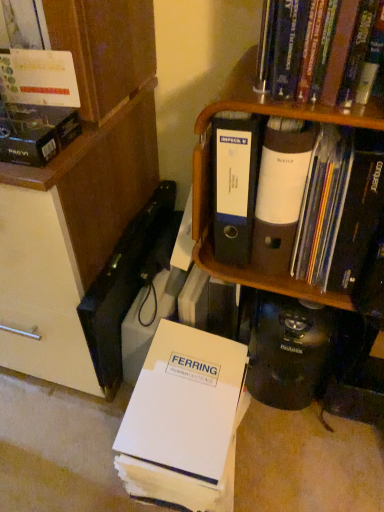
Question: Is matte black folder at upper right, the third book positioned from the top, wider or thinner than brown cardboard shelf at upper right?

Choices:
 (A) thin
 (B) wide

Answer: (A)

Question: Relative to brown cardboard shelf at upper right, is matte black folder at upper right, the second book positioned from the bottom, in front or behind?

Choices:
 (A) behind
 (B) front

Answer: (A)

Question: Which object is positioned farthest from the hardcover book at upper right, the 4th book positioned from the bottom?

Choices:
 (A) brown cardboard shelf at upper right
 (B) matte cardboard box at upper left, placed as the second book when sorted from top to bottom
 (C) matte black folder at upper right, the third book positioned from the top
 (D) white paper folder at lower center, positioned as the first book in bottom-to-top order

Answer: (D)

Question: Which of these objects is positioned closest to the matte cardboard box at upper left, placed as the second book when sorted from top to bottom?

Choices:
 (A) matte black folder at upper right, the second book positioned from the bottom
 (B) hardcover book at upper right, which is counted as the 1th book, starting from the top
 (C) brown cardboard shelf at upper right
 (D) white paper folder at lower center, placed as the 4th book when sorted from top to bottom

Answer: (C)